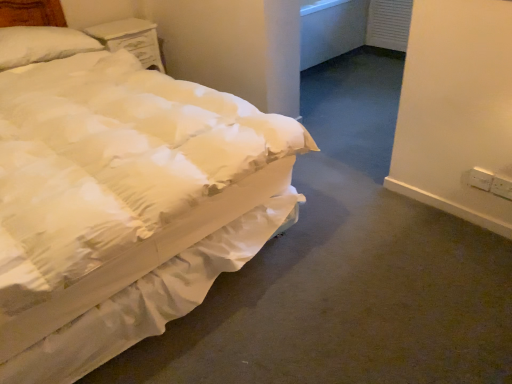
Question: Is white soft pillow at upper left not close to white plastic electric outlet at lower right, which ranks as the second electric outlet in left-to-right order?

Choices:
 (A) no
 (B) yes

Answer: (B)

Question: Is white soft pillow at upper left wider than white plastic electric outlet at lower right, which ranks as the second electric outlet in left-to-right order?

Choices:
 (A) no
 (B) yes

Answer: (B)

Question: Is white soft pillow at upper left outside white plastic electric outlet at lower right, which ranks as the second electric outlet in left-to-right order?

Choices:
 (A) no
 (B) yes

Answer: (B)

Question: Does white soft pillow at upper left lie in front of white plastic electric outlet at lower right, which is the first electric outlet in right-to-left order?

Choices:
 (A) yes
 (B) no

Answer: (B)

Question: Does white soft pillow at upper left appear on the right side of white plastic electric outlet at lower right, which is the first electric outlet in right-to-left order?

Choices:
 (A) no
 (B) yes

Answer: (A)

Question: Based on their positions, is white plastic electric outlet at lower right, which ranks as the second electric outlet in left-to-right order, located to the left or right of white painted wood nightstand at upper left?

Choices:
 (A) right
 (B) left

Answer: (A)

Question: Would you say white plastic electric outlet at lower right, which is the first electric outlet in right-to-left order, is inside or outside white painted wood nightstand at upper left?

Choices:
 (A) inside
 (B) outside

Answer: (B)

Question: From the image's perspective, is white plastic electric outlet at lower right, which is the first electric outlet in right-to-left order, above or below white painted wood nightstand at upper left?

Choices:
 (A) below
 (B) above

Answer: (A)

Question: Looking at their shapes, would you say white plastic electric outlet at lower right, which ranks as the second electric outlet in left-to-right order, is wider or thinner than white painted wood nightstand at upper left?

Choices:
 (A) wide
 (B) thin

Answer: (B)

Question: Is white plastic electric outlet at right, placed as the first electric outlet when sorted from left to right, taller or shorter than white quilted fabric bed at left?

Choices:
 (A) tall
 (B) short

Answer: (B)

Question: Choose the correct answer: Is white plastic electric outlet at right, placed as the first electric outlet when sorted from left to right, inside white quilted fabric bed at left or outside it?

Choices:
 (A) outside
 (B) inside

Answer: (A)

Question: In the image, is white plastic electric outlet at right, placed as the first electric outlet when sorted from left to right, on the left side or the right side of white quilted fabric bed at left?

Choices:
 (A) left
 (B) right

Answer: (B)

Question: In terms of size, does white plastic electric outlet at right, arranged as the second electric outlet when viewed from the right, appear bigger or smaller than white quilted fabric bed at left?

Choices:
 (A) big
 (B) small

Answer: (B)

Question: Considering their positions, is white plastic electric outlet at right, arranged as the second electric outlet when viewed from the right, located in front of or behind white painted wood nightstand at upper left?

Choices:
 (A) front
 (B) behind

Answer: (A)

Question: Is white plastic electric outlet at right, placed as the first electric outlet when sorted from left to right, spatially inside white painted wood nightstand at upper left, or outside of it?

Choices:
 (A) inside
 (B) outside

Answer: (B)